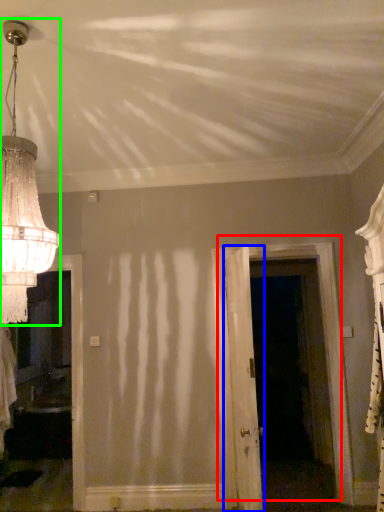
Question: Which is farther away from door (highlighted by a red box)? door (highlighted by a blue box) or lamp (highlighted by a green box)?

Choices:
 (A) door
 (B) lamp

Answer: (B)